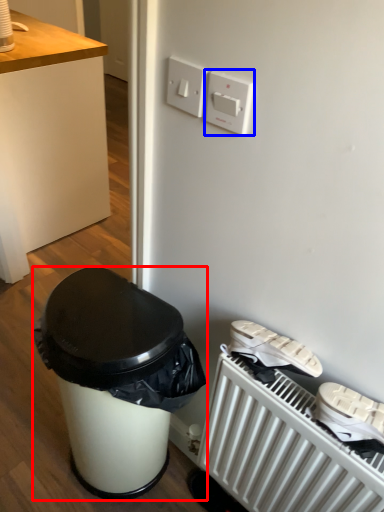
Question: Among these objects, which one is nearest to the camera, waste container (highlighted by a red box) or light switch (highlighted by a blue box)?

Choices:
 (A) waste container
 (B) light switch

Answer: (B)